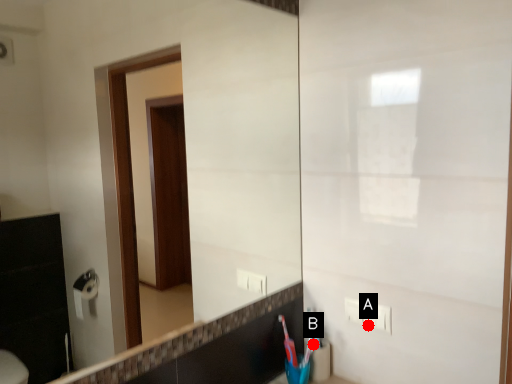
Question: Two points are circled on the image, labeled by A and B beside each circle. Which point is closer to the camera?

Choices:
 (A) A is closer
 (B) B is closer

Answer: (A)